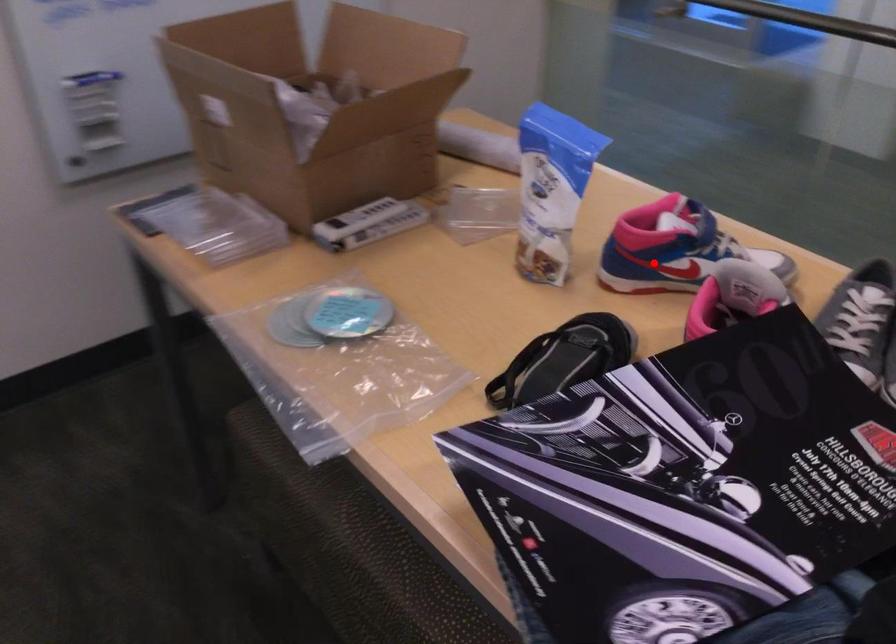
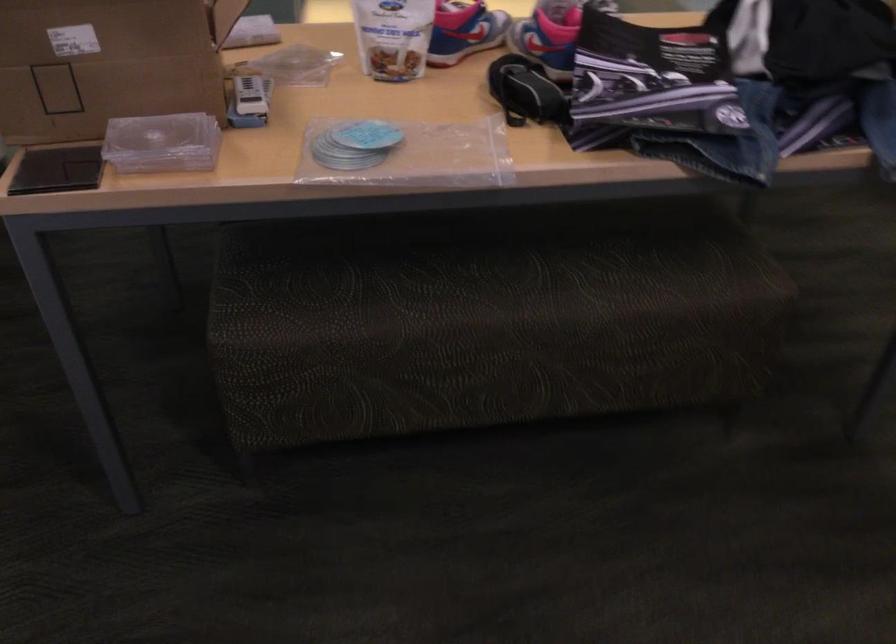
Question: I am providing you with two images of the same scene from different viewpoints. In image1, a red point is highlighted. Considering the same 3D point in image2, which of the following is correct?

Choices:
 (A) It is closer
 (B) It is farther

Answer: (B)